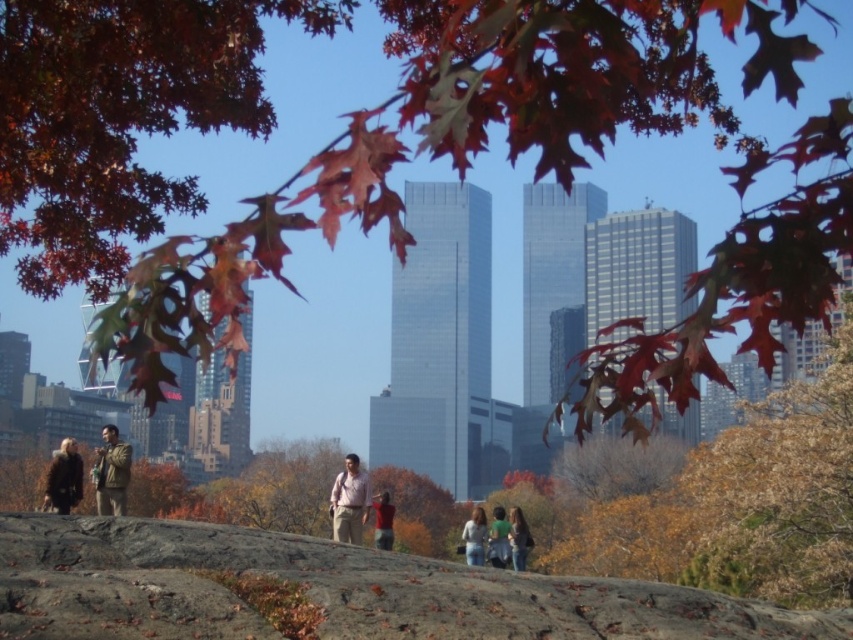
Does camouflage jacket at lower left come behind dark brown fur coat at lower left?

No, camouflage jacket at lower left is in front of dark brown fur coat at lower left.

In the scene shown: Who is higher up, camouflage jacket at lower left or dark brown fur coat at lower left?

Positioned higher is camouflage jacket at lower left.

Describe the element at coordinates (111, 472) in the screenshot. This screenshot has width=853, height=640. I see `camouflage jacket at lower left` at that location.

Where is `camouflage jacket at lower left`? The height and width of the screenshot is (640, 853). camouflage jacket at lower left is located at coordinates (111, 472).

In the scene shown: Does matte pink shirt at center appear under denim jeans at center?

No, matte pink shirt at center is not below denim jeans at center.

Does matte pink shirt at center appear on the left side of denim jeans at center?

Yes, matte pink shirt at center is to the left of denim jeans at center.

The image size is (853, 640). Identify the location of matte pink shirt at center. (349, 500).

Where is `matte pink shirt at center`? The width and height of the screenshot is (853, 640). matte pink shirt at center is located at coordinates (349, 500).

Between point (343, 476) and point (463, 541), which one is positioned in front?

Point (343, 476) is in front.

Is matte pink shirt at center positioned before light brown hair at center?

Yes, matte pink shirt at center is closer to the viewer.

Between point (361, 472) and point (465, 552), which one is positioned in front?

Point (361, 472)

At what (x,y) coordinates should I click in order to perform the action: click on matte pink shirt at center. Please return your answer as a coordinate pair (x, y). Image resolution: width=853 pixels, height=640 pixels. Looking at the image, I should click on (349, 500).